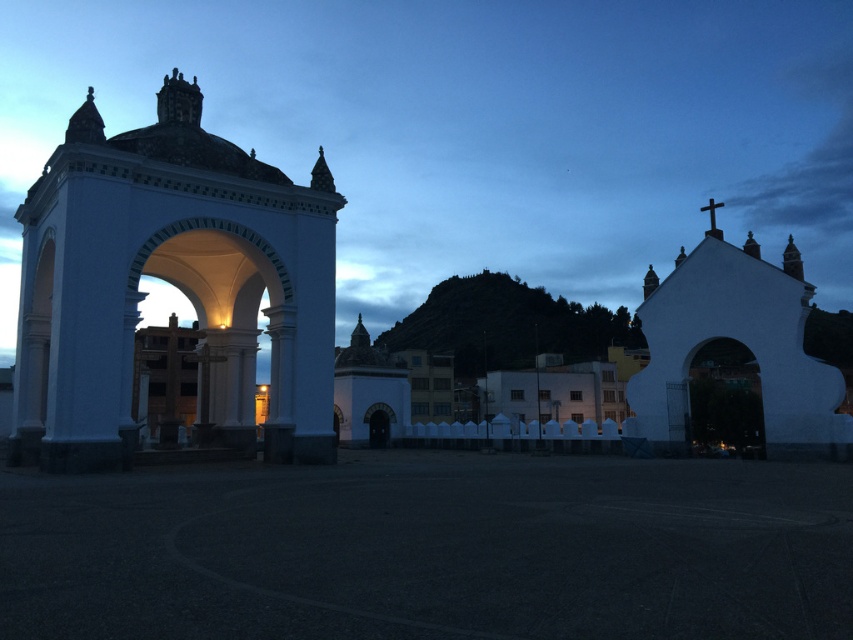
Is white stone arch at left further to camera compared to white matte church at right?

No.

Who is taller, white stone arch at left or white matte church at right?

white stone arch at left is taller.

You are a GUI agent. You are given a task and a screenshot of the screen. Output one action in this format:
    pyautogui.click(x=<x>, y=<y>)
    Task: Click on the white stone arch at left
    This screenshot has width=853, height=640.
    Given the screenshot: What is the action you would take?
    pyautogui.click(x=171, y=284)

Locate an element on the screen. The height and width of the screenshot is (640, 853). white stone arch at left is located at coordinates [171, 284].